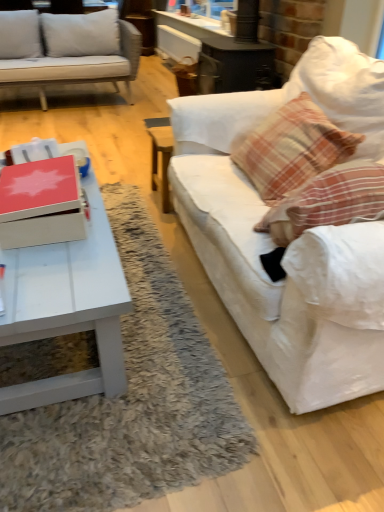
What is the approximate height of white matte coffee table at lower left?

white matte coffee table at lower left is 40.09 centimeters tall.

The height and width of the screenshot is (512, 384). Describe the element at coordinates (295, 240) in the screenshot. I see `white fabric couch at right` at that location.

Identify the location of white matte coffee table at lower left. The width and height of the screenshot is (384, 512). (67, 308).

Between plaid fabric pillow at right and matte red box at center, which one has less height?

Standing shorter between the two is matte red box at center.

From a real-world perspective, does plaid fabric pillow at right sit lower than matte red box at center?

Actually, plaid fabric pillow at right is physically above matte red box at center in the real world.

Find the location of a particular element. This screenshot has width=384, height=512. pillow behind the matte red box at center is located at coordinates (292, 148).

Who is smaller, plaid fabric pillow at right or matte red box at center?

matte red box at center is smaller.

Is point (299, 176) in front of point (363, 244)?

No, it is not.

Can you confirm if plaid fabric pillow at right is shorter than white fabric couch at right?

Correct, plaid fabric pillow at right is not as tall as white fabric couch at right.

Which of these two, plaid fabric pillow at right or white fabric couch at right, is smaller?

plaid fabric pillow at right.

Is plaid fabric pillow at right inside the boundaries of white fabric couch at right, or outside?

The correct answer is: inside.

Would you consider white matte coffee table at lower left to be distant from plaid fabric pillow at right?

They are positioned close to each other.

Considering the sizes of objects white matte coffee table at lower left and plaid fabric pillow at right in the image provided, who is wider, white matte coffee table at lower left or plaid fabric pillow at right?

white matte coffee table at lower left is wider.

Identify the location of pillow that appears on the right of white matte coffee table at lower left. This screenshot has height=512, width=384. (292, 148).

Can plaid fabric pillow at right be found inside white matte coffee table at lower left?

No, plaid fabric pillow at right is not a part of white matte coffee table at lower left.

Is the position of white matte coffee table at lower left less distant than that of matte red box at center?

Yes, it is in front of matte red box at center.

From the picture: Does white matte coffee table at lower left appear on the right side of matte red box at center?

Incorrect, white matte coffee table at lower left is not on the right side of matte red box at center.

Which is in front, point (16, 306) or point (27, 218)?

Point (16, 306)

Looking at this image, considering the positions of objects white fabric couch at right and plaid fabric pillow at right in the image provided, who is more to the right, white fabric couch at right or plaid fabric pillow at right?

Positioned to the right is white fabric couch at right.

Is point (291, 407) less distant than point (248, 143)?

Yes, it is.

Does white fabric couch at right have a larger size compared to plaid fabric pillow at right?

Yes, white fabric couch at right is bigger than plaid fabric pillow at right.

Find the location of `pillow above the white fabric couch at right (from a real-world perspective)`. pillow above the white fabric couch at right (from a real-world perspective) is located at coordinates (292, 148).

Looking at this image, considering the sizes of objects white fabric couch at right and white matte coffee table at lower left in the image provided, who is shorter, white fabric couch at right or white matte coffee table at lower left?

white matte coffee table at lower left is shorter.

From a real-world perspective, is white fabric couch at right on top of white matte coffee table at lower left?

Yes, from a real-world perspective, white fabric couch at right is above white matte coffee table at lower left.

Can you tell me how much white fabric couch at right and white matte coffee table at lower left differ in facing direction?

The angular difference between white fabric couch at right and white matte coffee table at lower left is 90 degrees.

From the image's perspective, would you say white fabric couch at right is positioned over white matte coffee table at lower left?

Indeed, from the image's perspective, white fabric couch at right is shown above white matte coffee table at lower left.

Which of these two, matte red box at center or white matte coffee table at lower left, is wider?

With larger width is white matte coffee table at lower left.

From the image's perspective, who appears lower, matte red box at center or white matte coffee table at lower left?

white matte coffee table at lower left, from the image's perspective.

From a real-world perspective, is matte red box at center on top of white matte coffee table at lower left?

Yes, from a real-world perspective, matte red box at center is above white matte coffee table at lower left.

From the picture: Could you tell me if matte red box at center is turned towards white matte coffee table at lower left?

No.

The width and height of the screenshot is (384, 512). Find the location of `box directly beneath the plaid fabric pillow at right (from a real-world perspective)`. box directly beneath the plaid fabric pillow at right (from a real-world perspective) is located at coordinates (42, 203).

Where is `studio couch that is on the right side of plaid fabric pillow at right`? Image resolution: width=384 pixels, height=512 pixels. studio couch that is on the right side of plaid fabric pillow at right is located at coordinates pos(295,240).

When comparing their distances from plaid fabric pillow at right, does white matte coffee table at lower left or matte red box at center seem closer?

white matte coffee table at lower left lies closer to plaid fabric pillow at right than the other object.

Considering their positions, is white fabric couch at right positioned further to matte red box at center than white matte coffee table at lower left?

white fabric couch at right is positioned further to the anchor matte red box at center.

From the image, which object appears to be farther from matte red box at center, white fabric couch at right or plaid fabric pillow at right?

The object further to matte red box at center is plaid fabric pillow at right.

In the scene shown: Which object lies further to the anchor point white fabric couch at right, plaid fabric pillow at right or white matte coffee table at lower left?

white matte coffee table at lower left.

From the image, which object appears to be farther from white matte coffee table at lower left, white fabric couch at right or plaid fabric pillow at right?

Based on the image, plaid fabric pillow at right appears to be further to white matte coffee table at lower left.

Looking at the image, which one is located closer to matte red box at center, white matte coffee table at lower left or white fabric couch at right?

white matte coffee table at lower left lies closer to matte red box at center than the other object.

When comparing their distances from matte red box at center, does white matte coffee table at lower left or plaid fabric pillow at right seem closer?

white matte coffee table at lower left is positioned closer to the anchor matte red box at center.

Which object lies nearer to the anchor point plaid fabric pillow at right, matte red box at center or white matte coffee table at lower left?

white matte coffee table at lower left.

The width and height of the screenshot is (384, 512). I want to click on pillow located between matte red box at center and white fabric couch at right in the left-right direction, so click(x=292, y=148).

At what (x,y) coordinates should I click in order to perform the action: click on box situated between white matte coffee table at lower left and white fabric couch at right from left to right. Please return your answer as a coordinate pair (x, y). Image resolution: width=384 pixels, height=512 pixels. Looking at the image, I should click on (42, 203).

The height and width of the screenshot is (512, 384). What are the coordinates of `box situated between white matte coffee table at lower left and plaid fabric pillow at right from left to right` in the screenshot? It's located at (42, 203).

Where is `pillow between white matte coffee table at lower left and white fabric couch at right in the horizontal direction`? The image size is (384, 512). pillow between white matte coffee table at lower left and white fabric couch at right in the horizontal direction is located at coordinates (292, 148).